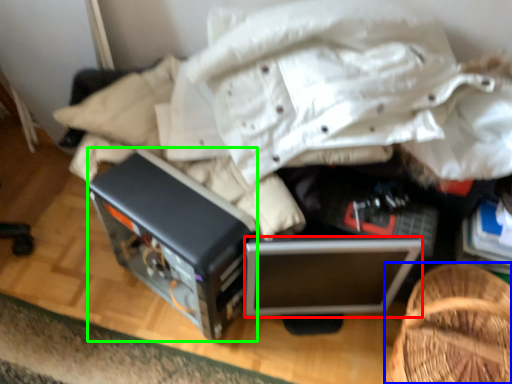
Question: Which object is positioned closest to computer (highlighted by a red box)? Select from furniture (highlighted by a blue box) and appliance (highlighted by a green box).

Choices:
 (A) furniture
 (B) appliance

Answer: (A)